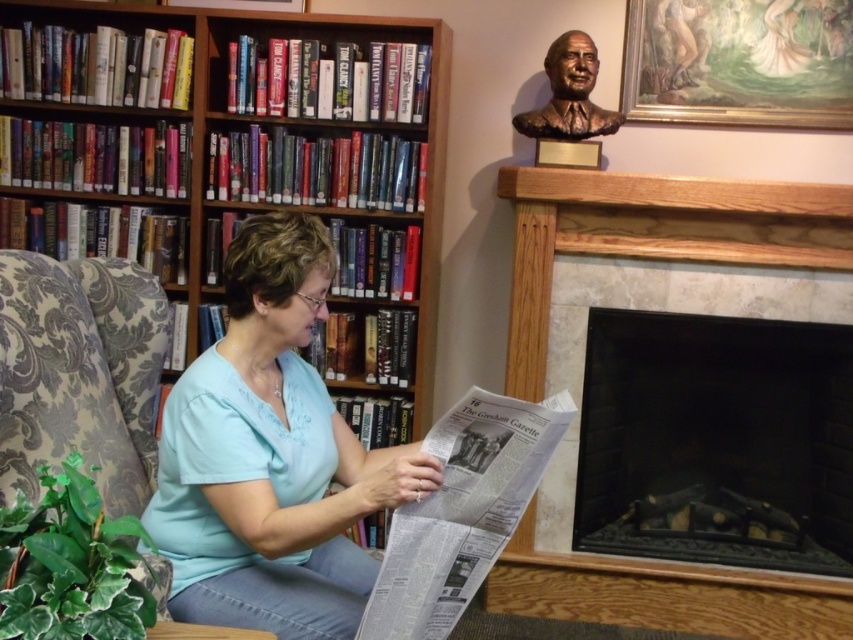
Question: Does wooden bookshelf at upper left appear under marble fireplace at center?

Choices:
 (A) no
 (B) yes

Answer: (A)

Question: Can you confirm if wooden bookshelf at upper left is thinner than patterned fabric armchair at left?

Choices:
 (A) yes
 (B) no

Answer: (B)

Question: Which point is closer to the camera?

Choices:
 (A) (630, 483)
 (B) (468, 579)
 (C) (202, 579)
 (D) (28, 493)

Answer: (B)

Question: Estimate the real-world distances between objects in this image. Which object is farther from the marble fireplace at center?

Choices:
 (A) wooden bookshelf at upper left
 (B) white newspaper at center
 (C) light blue fabric shirt at center

Answer: (B)

Question: Which point is farther from the camera taking this photo?

Choices:
 (A) (258, 273)
 (B) (114, 364)
 (C) (604, 524)
 (D) (766, 218)

Answer: (C)

Question: Considering the relative positions of marble fireplace at center and bronze bust at upper right in the image provided, where is marble fireplace at center located with respect to bronze bust at upper right?

Choices:
 (A) above
 (B) below

Answer: (B)